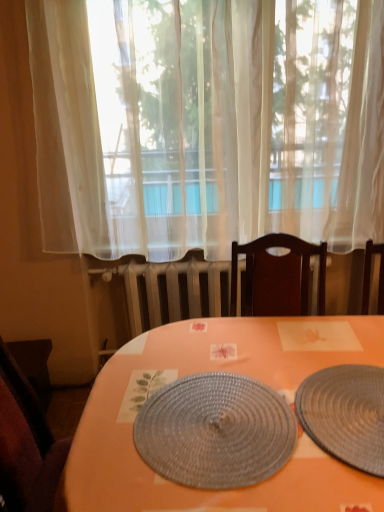
The height and width of the screenshot is (512, 384). Identify the location of blank space to the left of woven gray placemat at center, which is counted as the 1th plate, starting from the left. (106, 425).